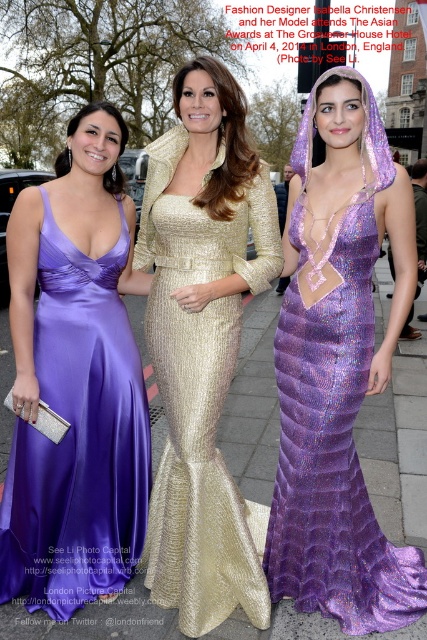
You are a photographer at a formal event. You need to adjust your camera focus to capture both the purple satin dress at center and the gold sequined dress at center. Which dress should you focus on first to ensure both are in sharp focus?

You should focus on the purple satin dress at center first since it is closer to the viewer than the gold sequined dress at center. By focusing on the closer object, the depth of field will naturally include the farther one in acceptable sharpness.

You are a photographer at the event and need to adjust the camera angle to ensure both the purple satin dress at center and the purple sequined dress at center are fully visible. Which dress requires you to lower the camera angle more to capture its full length?

The purple sequined dress at center is taller than the purple satin dress at center, so you need to lower the camera angle more to capture its full length.

You are a photographer at the event and want to capture a photo where both the purple sequined dress at center and the gold sequined dress at center are clearly visible. Based on their positions, which dress should you focus on first to ensure both are in frame?

Since the purple sequined dress at center is located below the gold sequined dress at center, you should focus on the gold sequined dress at center first to ensure both are in frame.